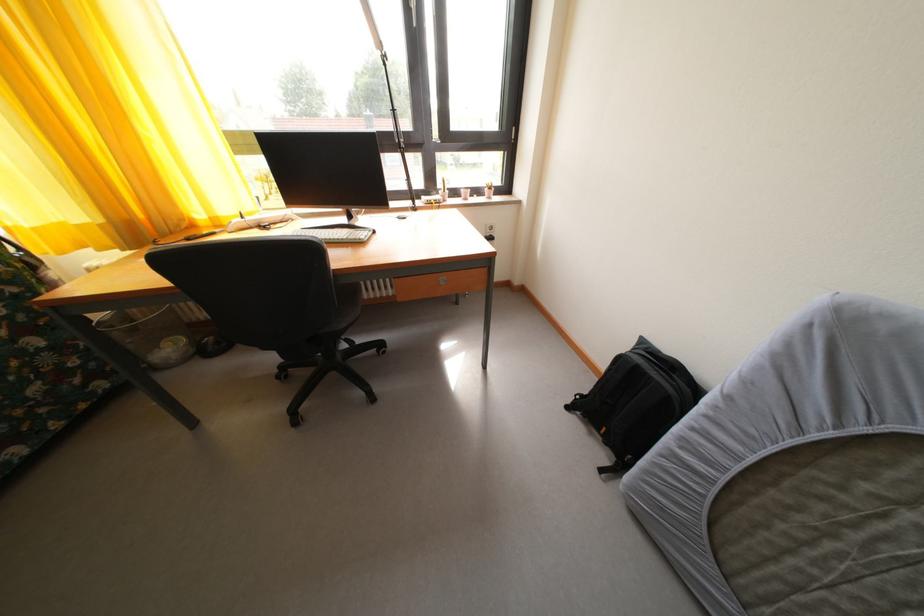
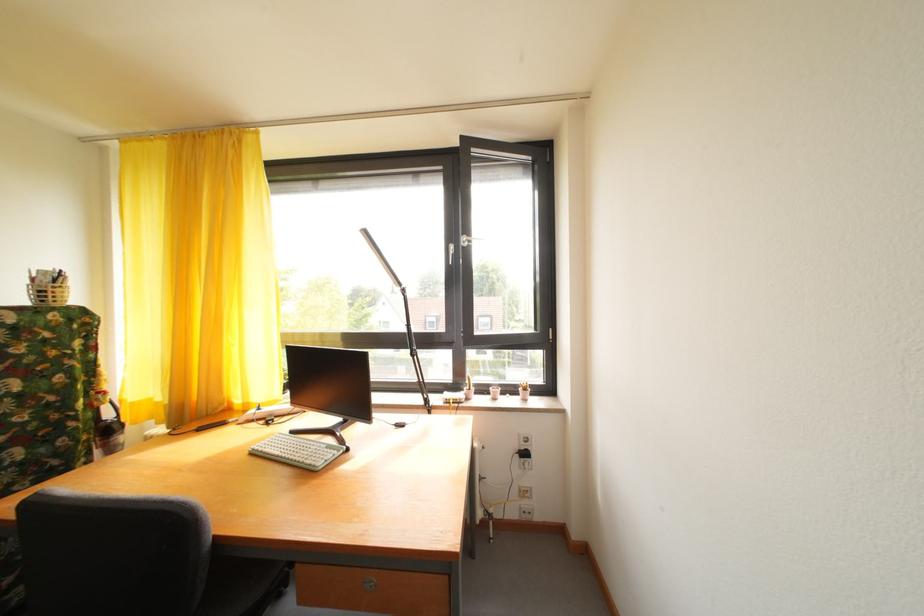
Locate, in the second image, the point that corresponds to point 464,199 in the first image.

(492, 395)